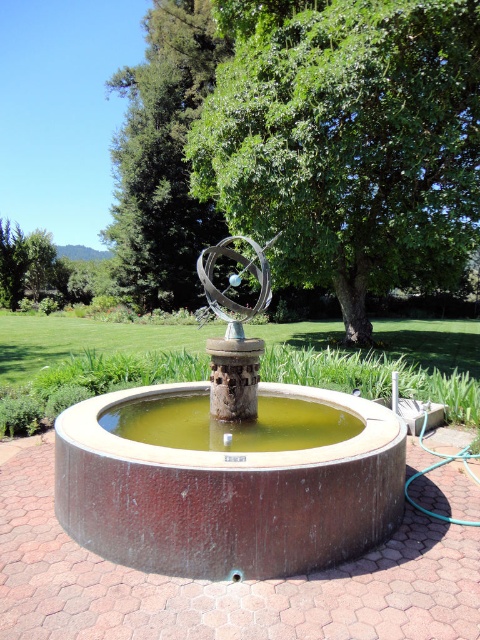
Question: Which point is closer to the camera?

Choices:
 (A) green leafy tree at center
 (B) greenish-brown water at center
 (C) green leafy tree at upper left
 (D) green concrete fountain at center

Answer: (B)

Question: Can you confirm if green concrete fountain at center is smaller than green leafy tree at upper center?

Choices:
 (A) yes
 (B) no

Answer: (A)

Question: Is rusty metal fountain at center positioned behind green leafy tree at upper center?

Choices:
 (A) yes
 (B) no

Answer: (B)

Question: Can you confirm if green leafy tree at center is positioned below green leafy tree at upper left?

Choices:
 (A) no
 (B) yes

Answer: (A)

Question: Among these objects, which one is farthest from the camera?

Choices:
 (A) metallic sculpture at center
 (B) green leafy tree at center

Answer: (B)

Question: Estimate the real-world distances between objects in this image. Which object is farther from the green leafy tree at upper left?

Choices:
 (A) green leafy tree at upper center
 (B) greenish-brown water at center

Answer: (B)